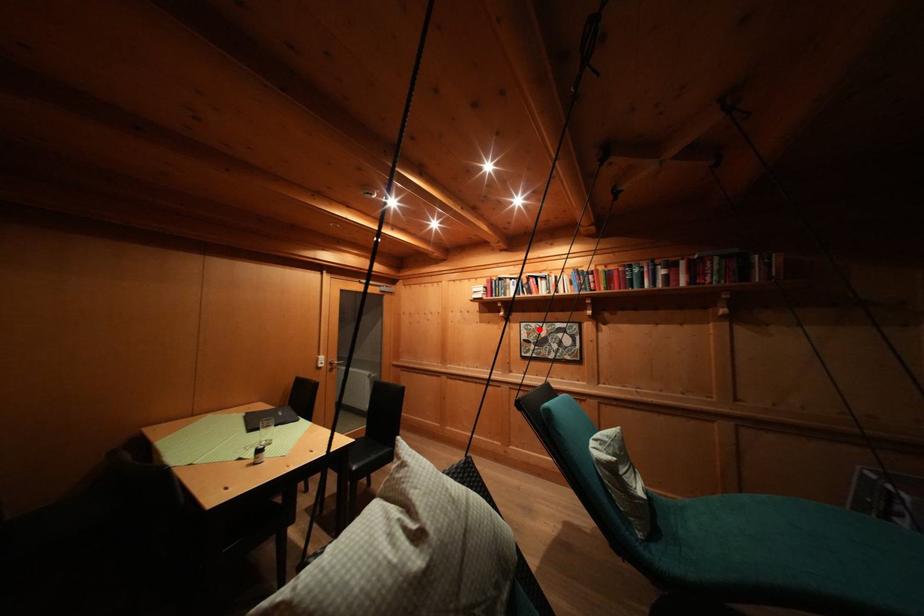
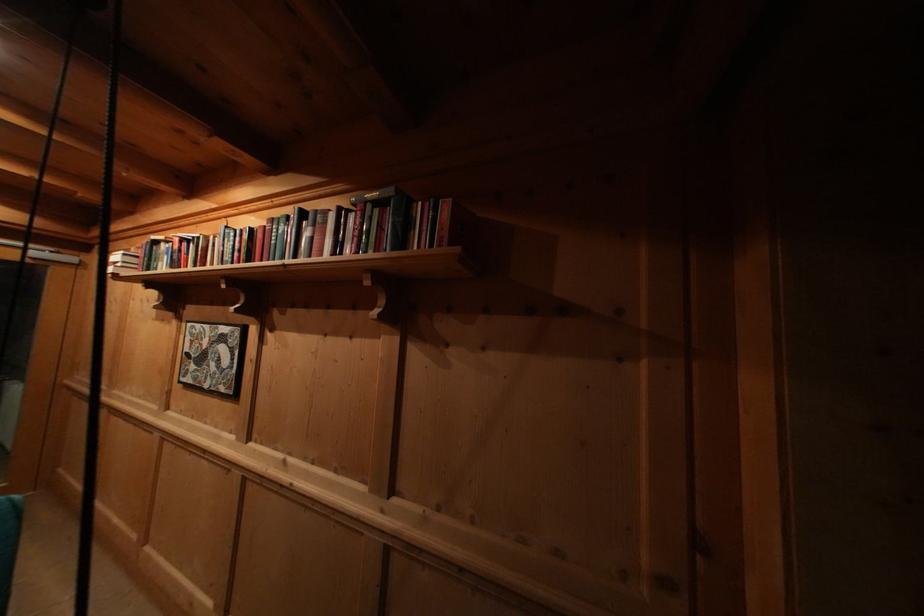
The point at the highlighted location is marked in the first image. Where is the corresponding point in the second image?

(204, 331)